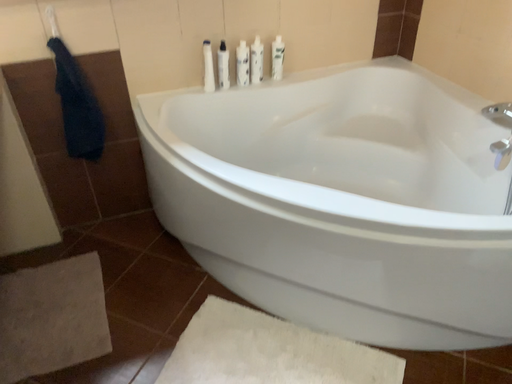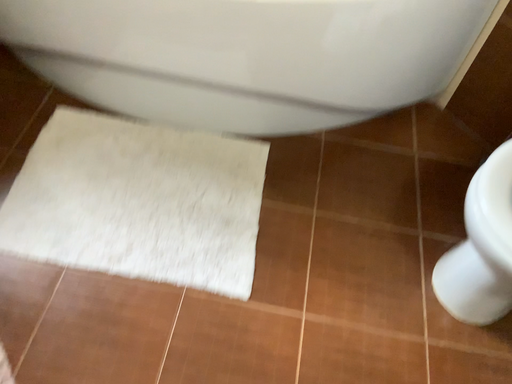
Question: Which way did the camera rotate in the video?

Choices:
 (A) rotated upward
 (B) rotated downward

Answer: (B)